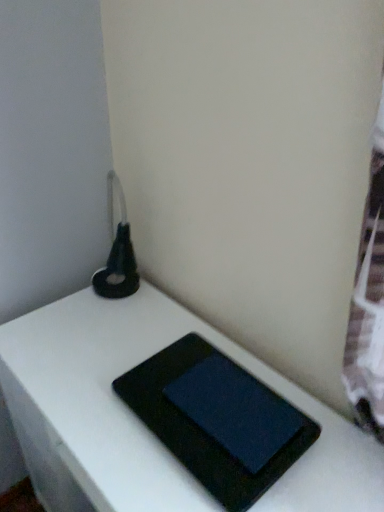
I want to click on free location to the left of matte black tablet at center, acting as the 2th tablet computer starting from the bottom, so click(121, 431).